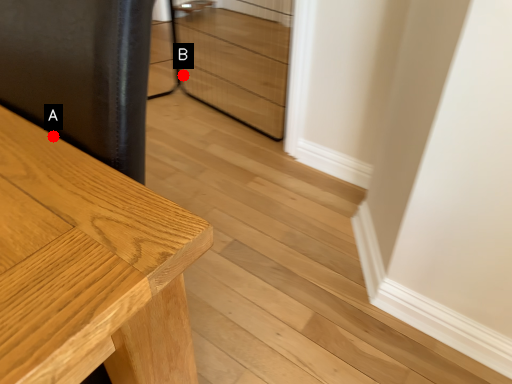
Question: Two points are circled on the image, labeled by A and B beside each circle. Which point is closer to the camera taking this photo?

Choices:
 (A) A is closer
 (B) B is closer

Answer: (A)